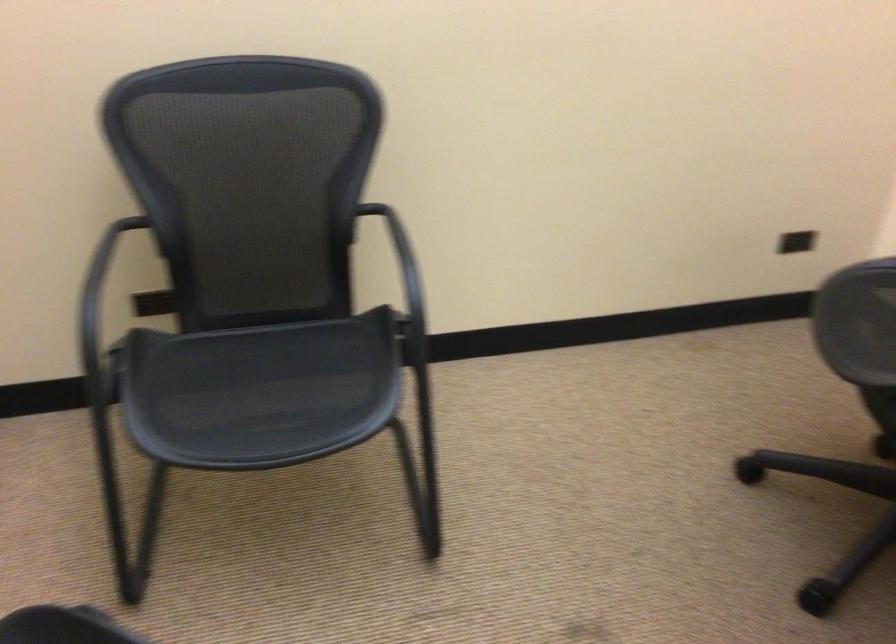
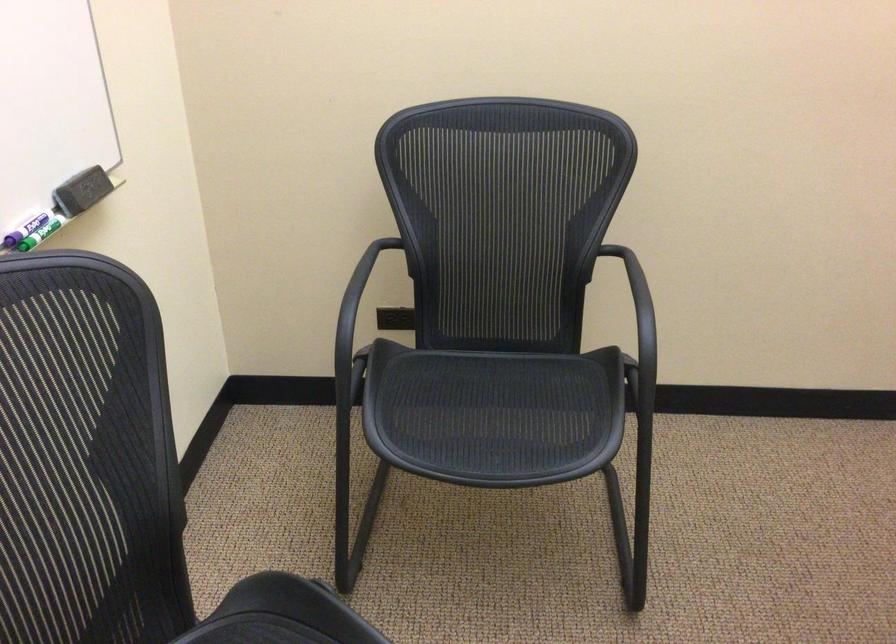
In the second image, find the point that corresponds to pixel 410 308 in the first image.

(639, 348)